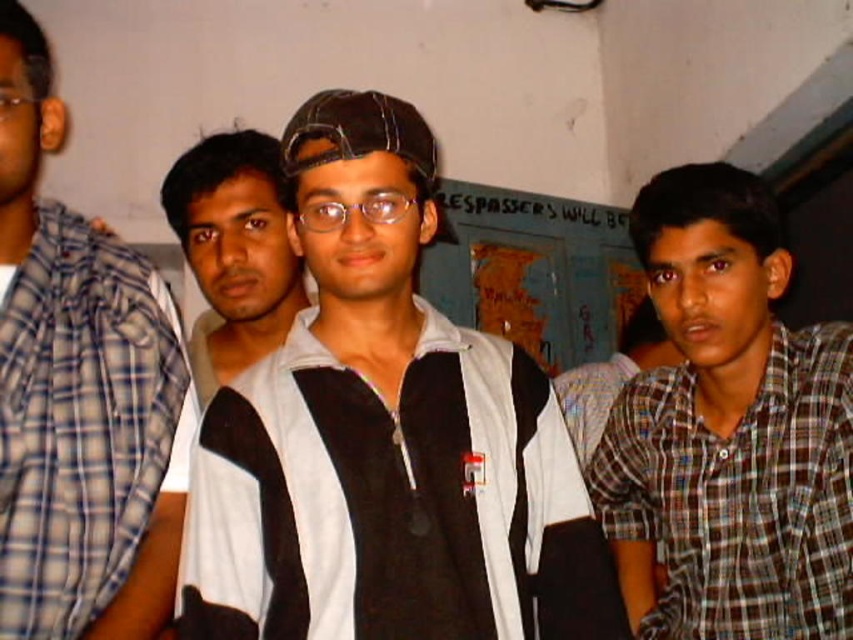
You are standing in the room and want to move closer to both the point at coordinates (712,372) and the point at coordinates (231,227). Which point should you move toward first to reach the closer one?

Point (712,372) is closer to the viewer than point (231,227), so you should move toward point (712,372) first.